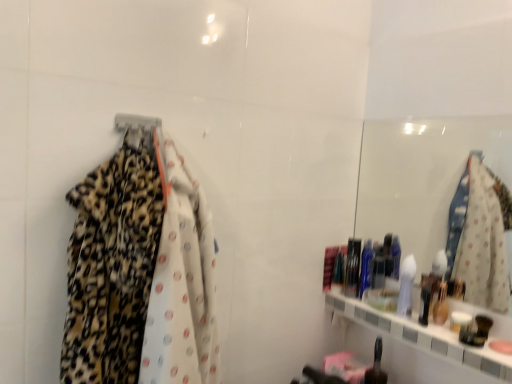
Question: Does leopard print fabric at left lie in front of shiny plastic container at right, the 2th toiletry from the front?

Choices:
 (A) yes
 (B) no

Answer: (A)

Question: From a real-world perspective, does leopard print fabric at left stand above shiny plastic container at right, the 2th toiletry from the front?

Choices:
 (A) yes
 (B) no

Answer: (A)

Question: Is shiny plastic container at right, which is the 1th toiletry in back-to-front order, located within leopard print fabric at left?

Choices:
 (A) yes
 (B) no

Answer: (B)

Question: Considering the relative sizes of leopard print fabric at left and shiny plastic container at right, marked as the second toiletry in a bottom-to-top arrangement, in the image provided, is leopard print fabric at left shorter than shiny plastic container at right, marked as the second toiletry in a bottom-to-top arrangement,?

Choices:
 (A) no
 (B) yes

Answer: (A)

Question: Is leopard print fabric at left to the right of shiny plastic container at right, marked as the second toiletry in a bottom-to-top arrangement, from the viewer's perspective?

Choices:
 (A) yes
 (B) no

Answer: (B)

Question: Would you say leopard print fabric at left is a long distance from shiny plastic container at right, marked as the second toiletry in a bottom-to-top arrangement?

Choices:
 (A) yes
 (B) no

Answer: (B)

Question: Does metallic silver hanger at upper left have a smaller size compared to shiny plastic container at right, the 2th toiletry from the front?

Choices:
 (A) yes
 (B) no

Answer: (A)

Question: Considering the relative positions of metallic silver hanger at upper left and shiny plastic container at right, marked as the second toiletry in a bottom-to-top arrangement, in the image provided, is metallic silver hanger at upper left to the right of shiny plastic container at right, marked as the second toiletry in a bottom-to-top arrangement, from the viewer's perspective?

Choices:
 (A) no
 (B) yes

Answer: (A)

Question: Is metallic silver hanger at upper left oriented away from shiny plastic container at right, which is the 1th toiletry in back-to-front order?

Choices:
 (A) no
 (B) yes

Answer: (A)

Question: Is shiny plastic container at right, which is the 1th toiletry in back-to-front order, a part of metallic silver hanger at upper left?

Choices:
 (A) no
 (B) yes

Answer: (A)

Question: Does metallic silver hanger at upper left have a greater height compared to shiny plastic container at right, the 2th toiletry from the front?

Choices:
 (A) yes
 (B) no

Answer: (B)

Question: Could you tell me if metallic silver hanger at upper left is turned towards shiny plastic container at right, the 2th toiletry from the front?

Choices:
 (A) yes
 (B) no

Answer: (B)

Question: Is leopard print fabric at left positioned with its back to metallic silver hanger at upper left?

Choices:
 (A) no
 (B) yes

Answer: (B)